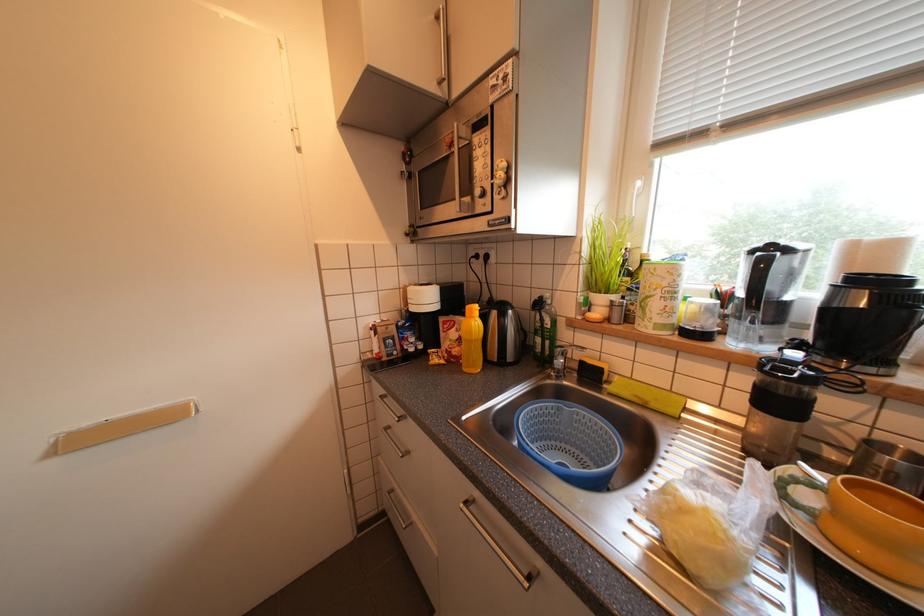
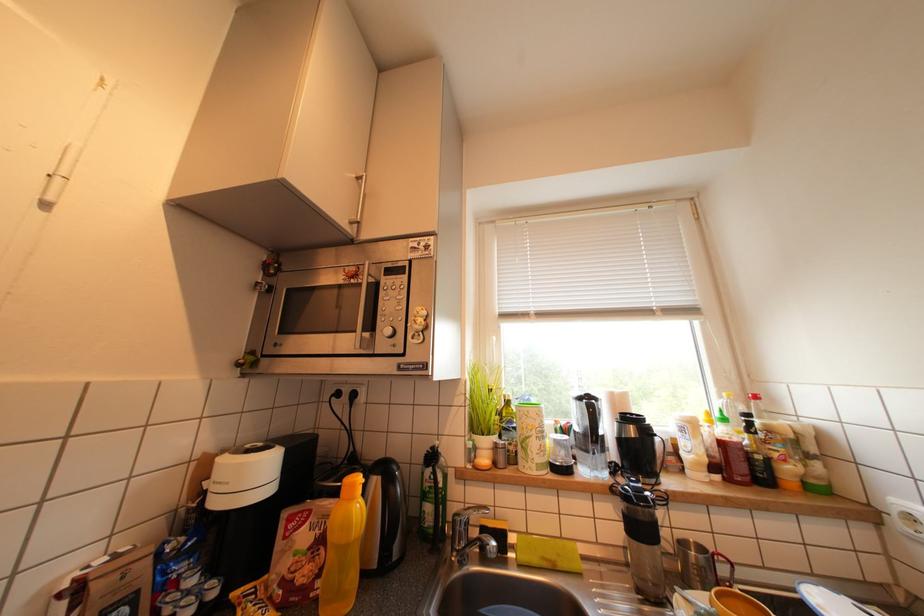
First-person continuous shooting, in which direction is the camera rotating?

The rotation direction of the camera is right-up.